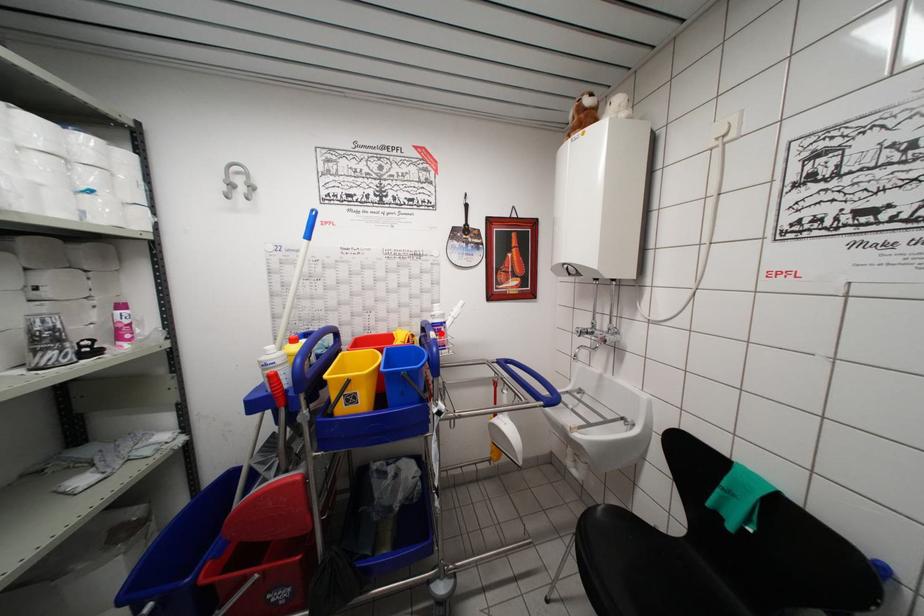
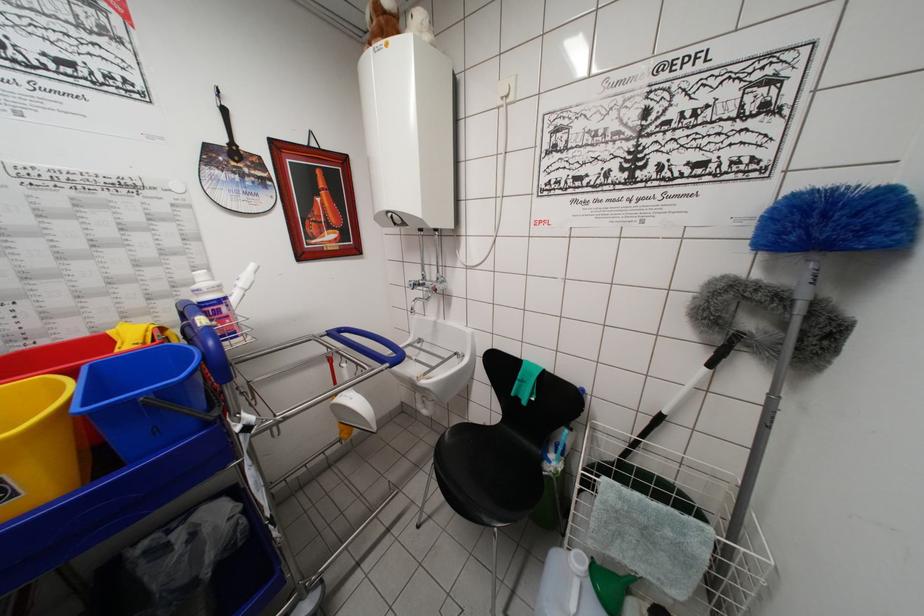
Locate, in the second image, the point that corresponds to the highlighted location in the first image.

(215, 315)